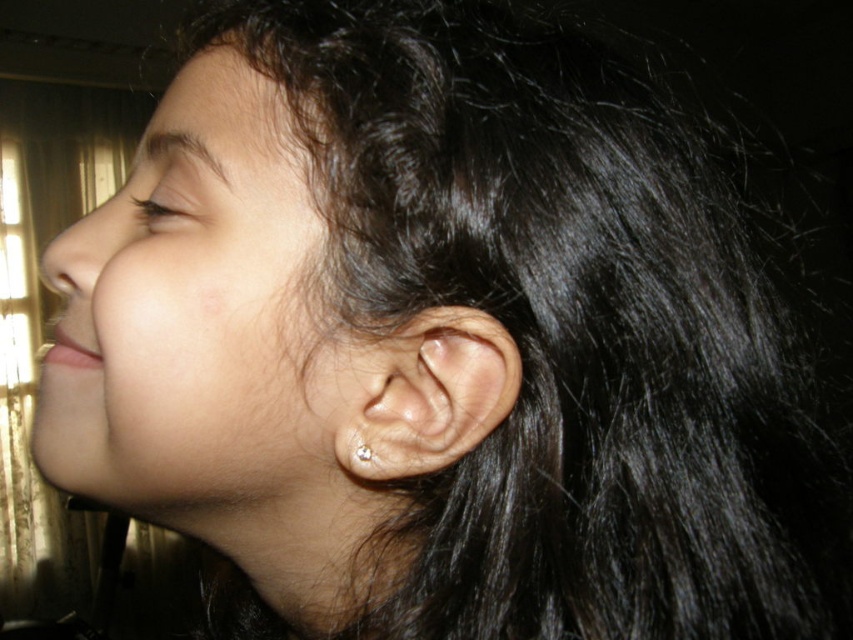
You are a dermatologist examining a patient. You notice the clear skin ear at center and the clear crystal earring at ear. How far apart are these two features on the patient?

The clear skin ear at center is 0.88 inches from the clear crystal earring at ear.

You are a photographer adjusting lighting for a portrait. You notice the clear skin ear at center and the clear crystal earring at ear in your frame. Which object is wider when viewed from your current angle?

The clear skin ear at center is wider than the clear crystal earring at ear.